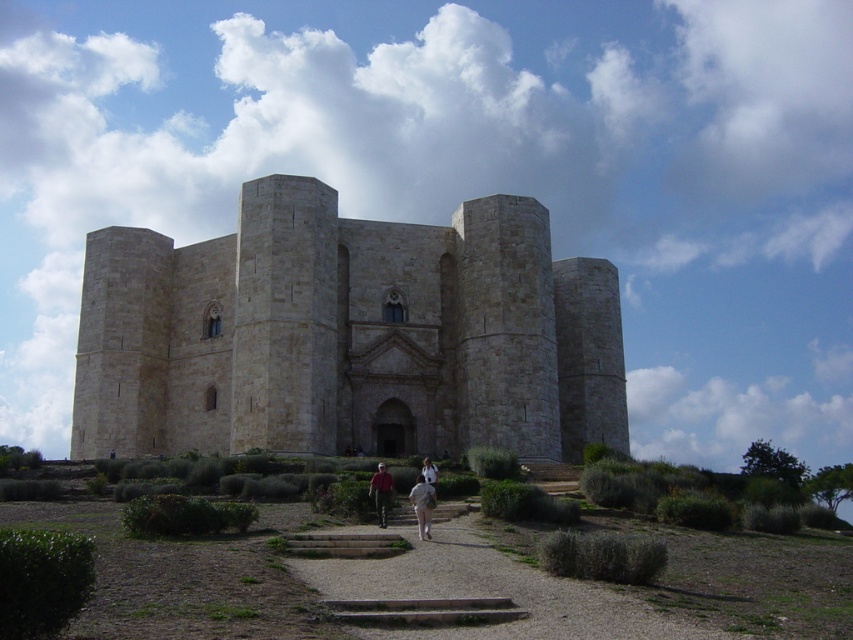
Question: Which point appears farthest from the camera in this image?

Choices:
 (A) (428, 506)
 (B) (534, 205)

Answer: (B)

Question: Which of these objects is positioned closest to the gravel pathway at center?

Choices:
 (A) beige stone castle at center
 (B) light beige fabric pants at center
 (C) red shirt at center

Answer: (B)

Question: Can you confirm if light beige fabric pants at center is wider than red shirt at center?

Choices:
 (A) yes
 (B) no

Answer: (A)

Question: Which object appears closest to the camera in this image?

Choices:
 (A) light beige fabric pants at center
 (B) red shirt at center

Answer: (A)

Question: Can you confirm if beige stone castle at center is wider than gravel pathway at center?

Choices:
 (A) no
 (B) yes

Answer: (B)

Question: Does beige stone castle at center appear on the left side of red shirt at center?

Choices:
 (A) yes
 (B) no

Answer: (A)